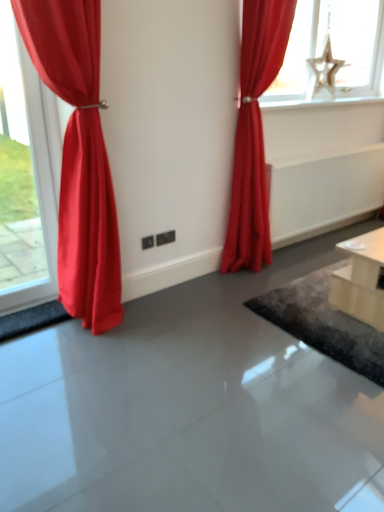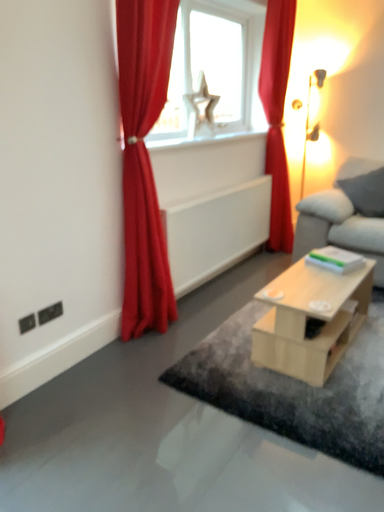
Question: Which way did the camera rotate in the video?

Choices:
 (A) rotated right
 (B) rotated left

Answer: (A)